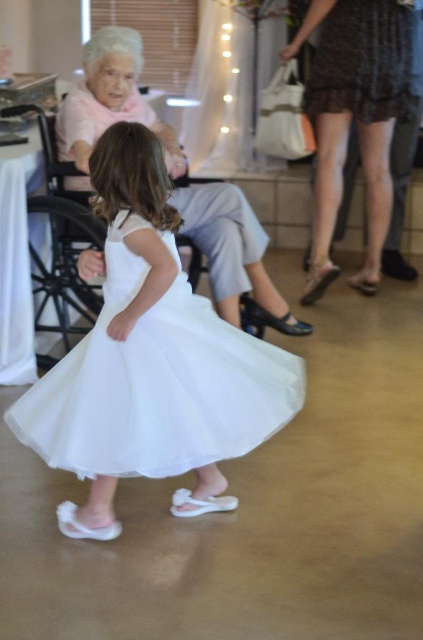
Question: Considering the relative positions of dark brown textured dress at upper right and matte pink dress at upper left in the image provided, where is dark brown textured dress at upper right located with respect to matte pink dress at upper left?

Choices:
 (A) left
 (B) right

Answer: (B)

Question: Does white tulle dress at center appear on the left side of matte pink dress at upper left?

Choices:
 (A) yes
 (B) no

Answer: (A)

Question: Is white tulle dress at center bigger than dark brown textured dress at upper right?

Choices:
 (A) yes
 (B) no

Answer: (B)

Question: Which object is closer to the camera taking this photo?

Choices:
 (A) matte pink dress at upper left
 (B) white tulle dress at center
 (C) dark brown textured dress at upper right

Answer: (B)

Question: Which object appears closest to the camera in this image?

Choices:
 (A) matte pink dress at upper left
 (B) dark brown textured dress at upper right
 (C) white tulle dress at center

Answer: (C)

Question: Which point is closer to the camera taking this photo?

Choices:
 (A) (121, 109)
 (B) (364, 49)

Answer: (A)